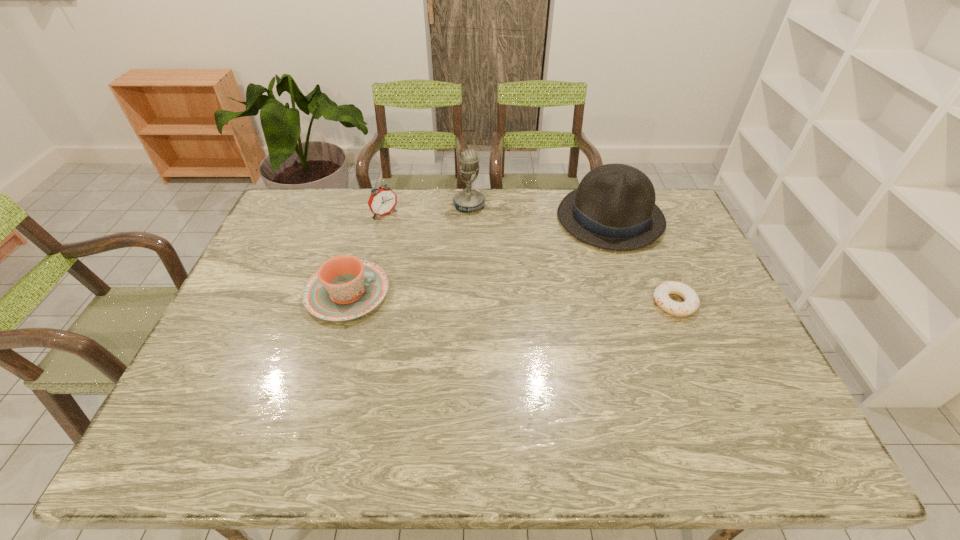
Identify which object is the nearest to the microphone. Please provide its 2D coordinates. Your answer should be formatted as a tuple, i.e. [(x, y)], where the tuple contains the x and y coordinates of a point satisfying the conditions above.

[(382, 201)]

What are the coordinates of `free space that satisfies the following two spatial constraints: 1. on the front side of the alarm clock; 2. on the left side of the bowler hat` in the screenshot? It's located at (384, 218).

Image resolution: width=960 pixels, height=540 pixels. In order to click on free spot that satisfies the following two spatial constraints: 1. on the front side of the second tallest object; 2. on the left side of the doughnut in this screenshot , I will do `click(639, 303)`.